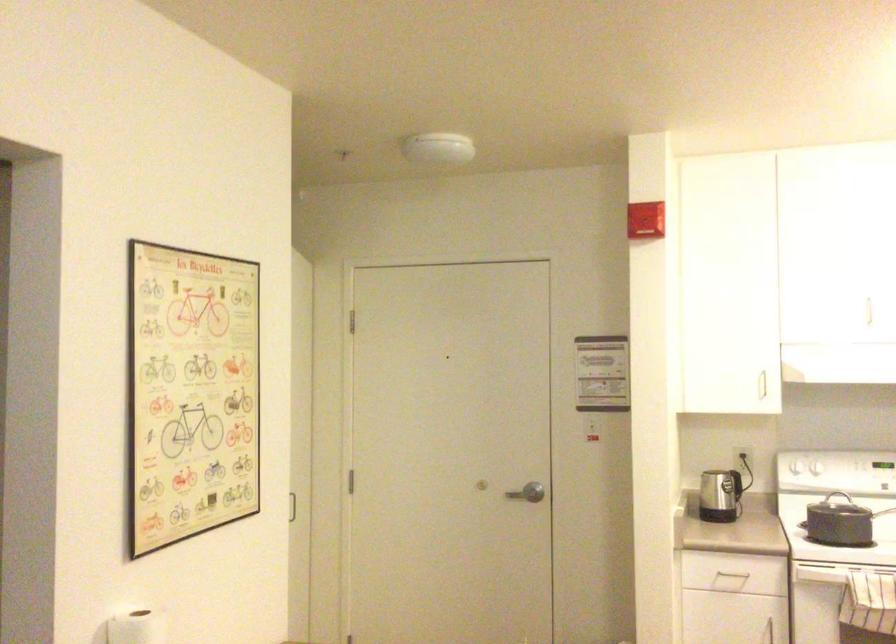
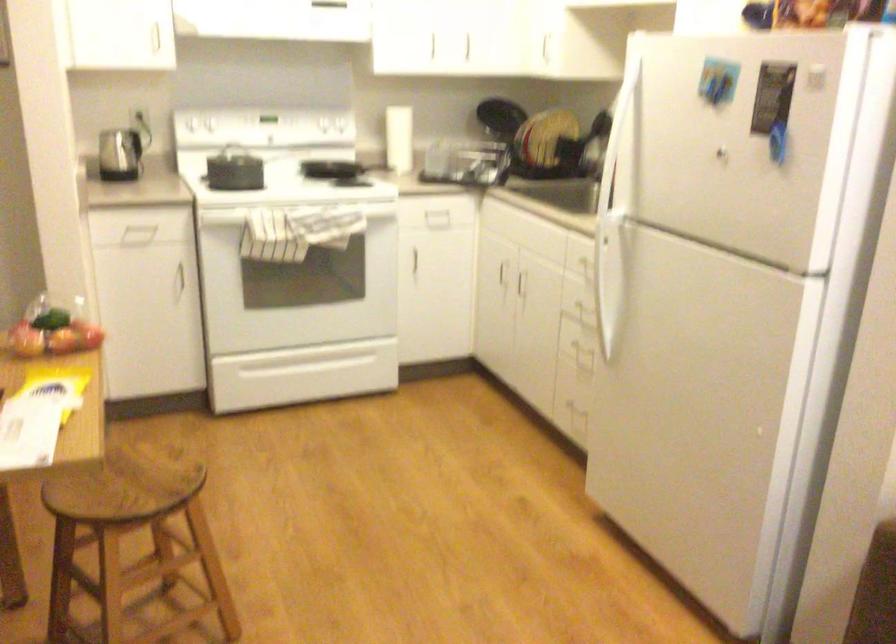
Locate, in the second image, the point that corresponds to [755,473] in the first image.

(149, 131)